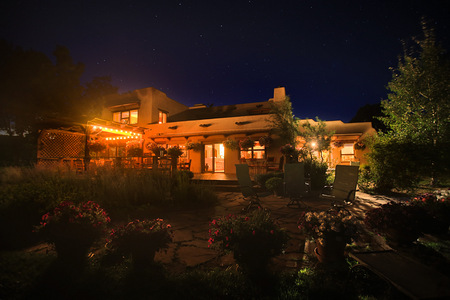
Where is `light`? light is located at coordinates (314, 144).